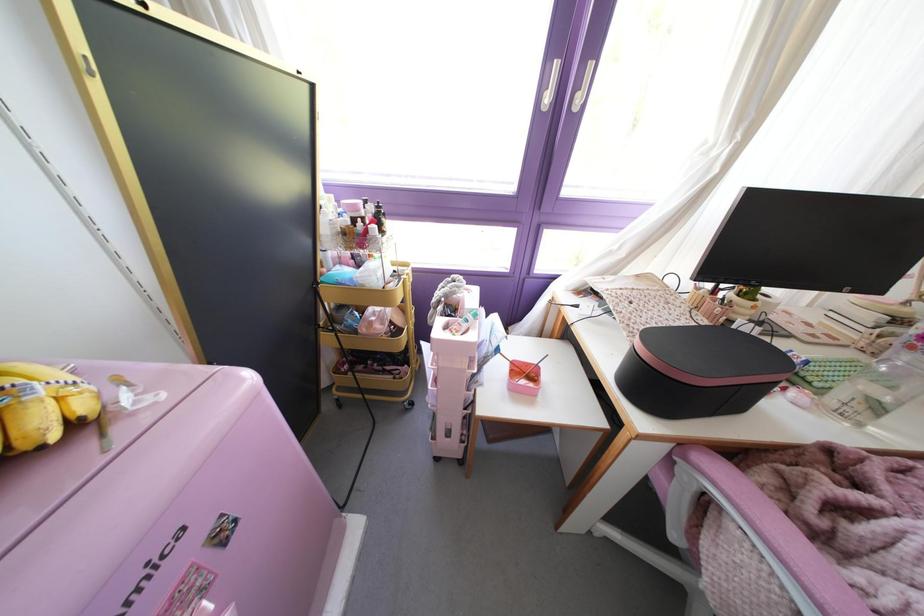
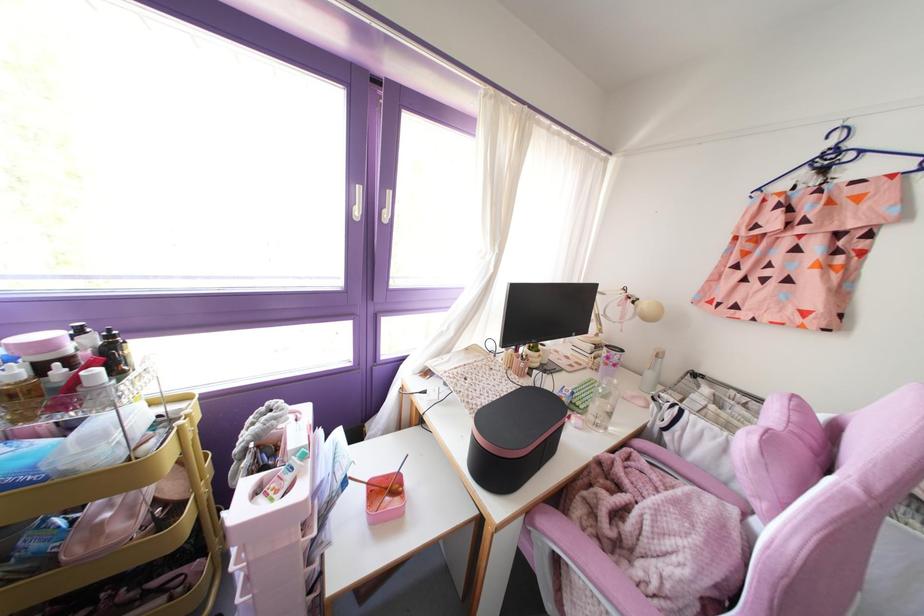
In the second image, find the point that corresponds to (361,217) in the first image.

(67, 360)